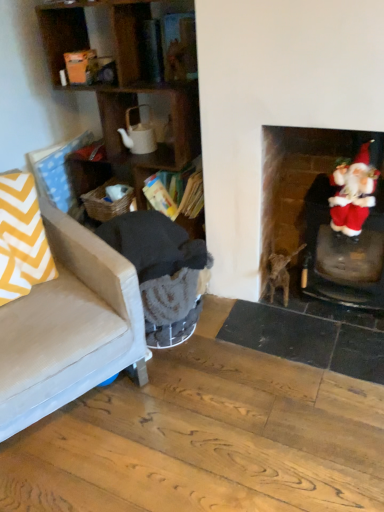
Question: In terms of width, does velvet santa at right look wider or thinner when compared to brown fur cat at center?

Choices:
 (A) thin
 (B) wide

Answer: (A)

Question: From a real-world perspective, is velvet santa at right above or below brown fur cat at center?

Choices:
 (A) below
 (B) above

Answer: (B)

Question: Based on their relative distances, which object is nearer to the wooden shelves at left?

Choices:
 (A) woven brown laundry basket at lower left
 (B) yellow chevron fabric at left
 (C) velvet santa at right
 (D) wooden bookshelf at center
 (E) beige fabric couch at left

Answer: (D)

Question: Estimate the real-world distances between objects in this image. Which object is closer to the beige fabric couch at left?

Choices:
 (A) dark gray fabric rocking chair at left
 (B) yellow chevron fabric at left
 (C) woven brown laundry basket at lower left
 (D) wooden shelves at left
 (E) velvet santa at right

Answer: (B)